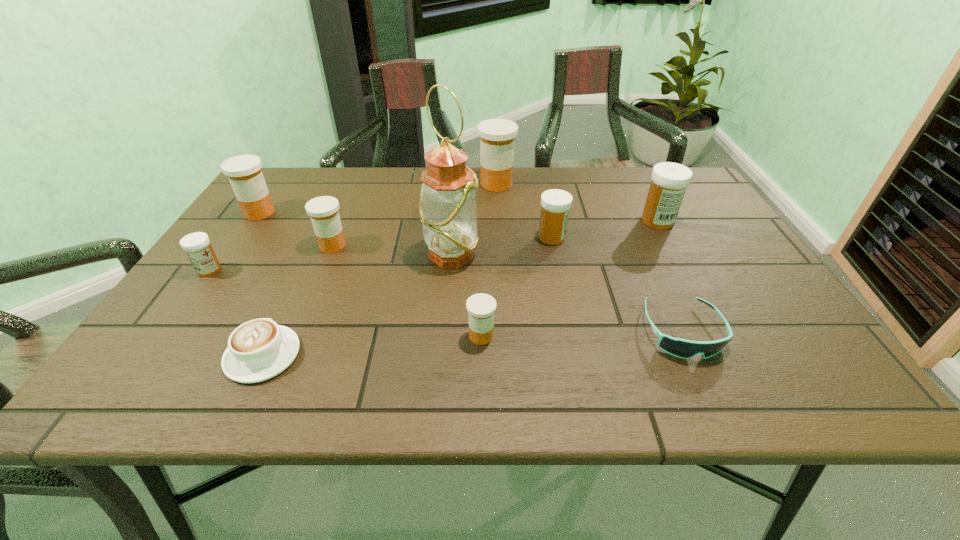
Find the location of a particular element. The height and width of the screenshot is (540, 960). medicine that can be found as the fourth closest to the third farthest orange medicine is located at coordinates (497, 136).

In order to click on medicine that is the third closest one to the oil lamp in this screenshot , I will do `click(323, 211)`.

At what (x,y) coordinates should I click in order to perform the action: click on the second closest orange medicine to the third nearest orange medicine. Please return your answer as a coordinate pair (x, y). The width and height of the screenshot is (960, 540). Looking at the image, I should click on (497, 136).

I want to click on the second closest orange medicine relative to the third nearest orange medicine, so click(x=497, y=136).

The height and width of the screenshot is (540, 960). I want to click on white medicine that stands as the third closest to the second biggest orange medicine, so click(669, 181).

Locate which white medicine ranks in proximity to the tallest object. Please provide its 2D coordinates. Your answer should be formatted as a tuple, i.e. [(x, y)], where the tuple contains the x and y coordinates of a point satisfying the conditions above.

[(555, 204)]

Identify the location of free location that satisfies the following two spatial constraints: 1. with the handle on the right side of the cappuccino; 2. on the label of the second biggest orange medicine. (329, 213).

This screenshot has width=960, height=540. I want to click on vacant space that satisfies the following two spatial constraints: 1. with the handle on the right side of the cappuccino; 2. on the label of the leftmost orange medicine, so click(x=329, y=213).

I want to click on vacant position in the image that satisfies the following two spatial constraints: 1. on the label of the third smallest orange medicine; 2. on the right side of the second white medicine from left to right, so click(243, 238).